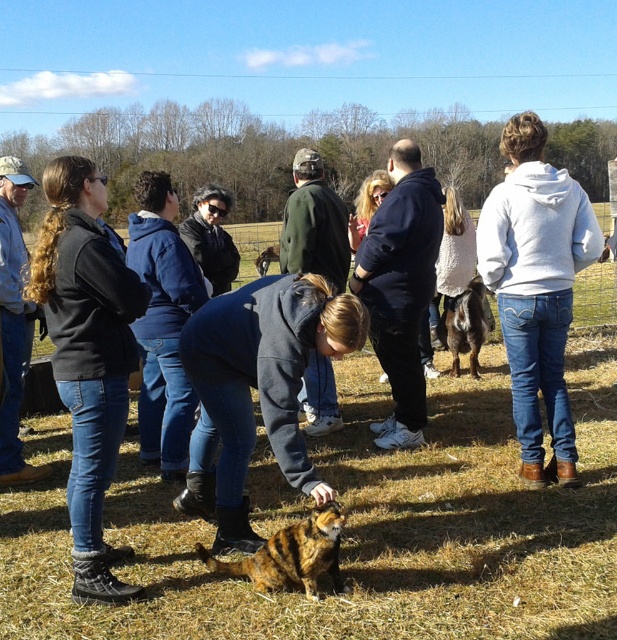
You are a photographer trying to capture a photo of the striped fur cat at center and the blonde hair at center. Which one should you focus on first if you want to ensure both are in the frame without moving the camera?

The striped fur cat at center is smaller than the blonde hair at center, so you should focus on the larger object first, which is the blonde hair at center, to ensure proper framing.

You are standing in the grassy field and see the white hoodie at upper right and the dark blue hoodie at center. Which hoodie is positioned to the right side of the other?

The white hoodie at upper right is positioned to the right of the dark blue hoodie at center.